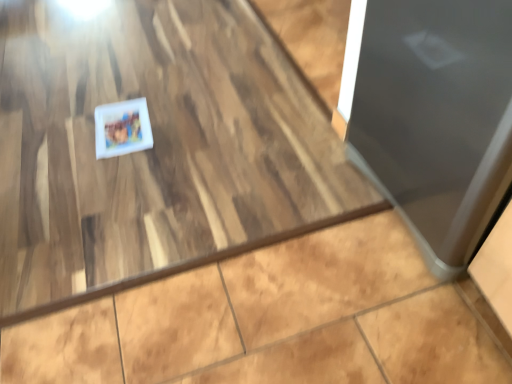
Identify the location of vacant space to the left of white matte postcard at center. (62, 134).